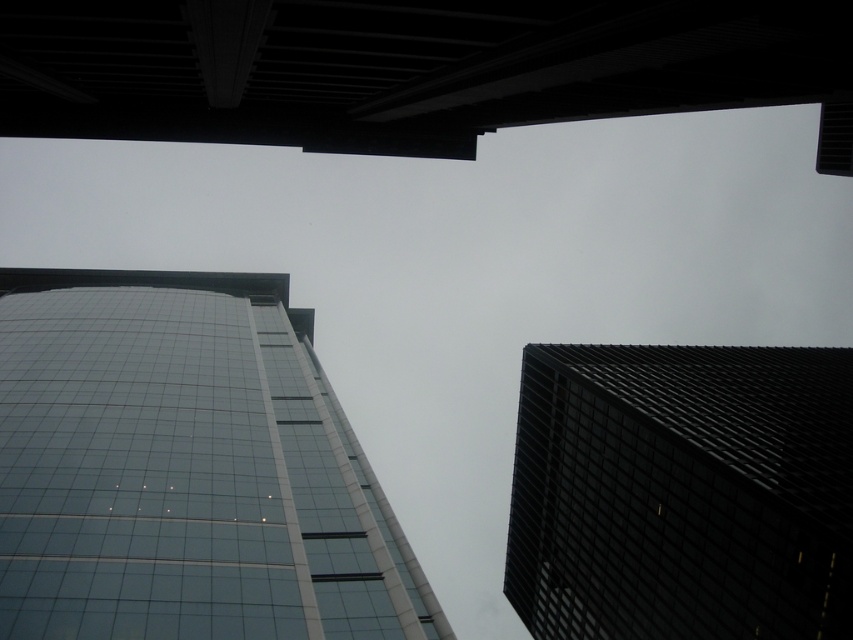
Question: Among these objects, which one is nearest to the camera?

Choices:
 (A) black textured building at right
 (B) glassy reflective building at center

Answer: (B)

Question: Is glassy reflective building at center smaller than black textured building at right?

Choices:
 (A) yes
 (B) no

Answer: (A)

Question: Which object appears closest to the camera in this image?

Choices:
 (A) glassy reflective building at center
 (B) black textured building at right

Answer: (A)

Question: Does glassy reflective building at center lie in front of black textured building at right?

Choices:
 (A) yes
 (B) no

Answer: (A)

Question: Is glassy reflective building at center in front of black textured building at right?

Choices:
 (A) no
 (B) yes

Answer: (B)